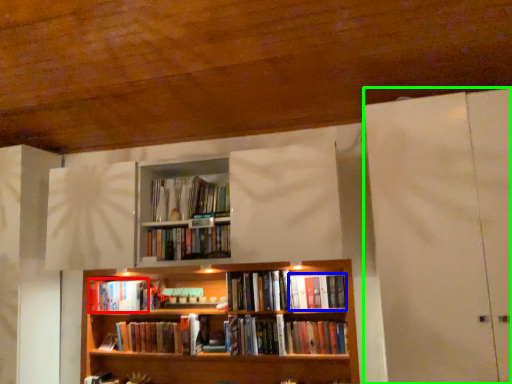
Question: Which object is positioned closest to book (highlighted by a red box)? Select from book (highlighted by a blue box) and glass door (highlighted by a green box).

Choices:
 (A) book
 (B) glass door

Answer: (A)